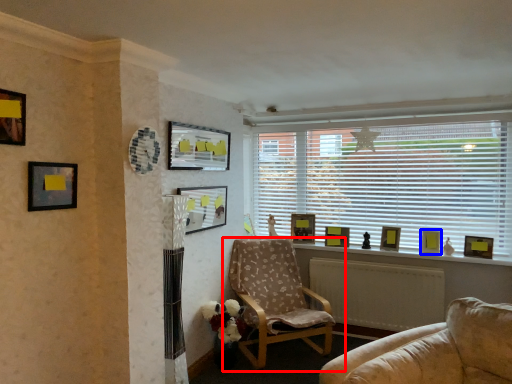
Question: Which object is closer to the camera taking this photo, chair (highlighted by a red box) or picture frame (highlighted by a blue box)?

Choices:
 (A) chair
 (B) picture frame

Answer: (A)